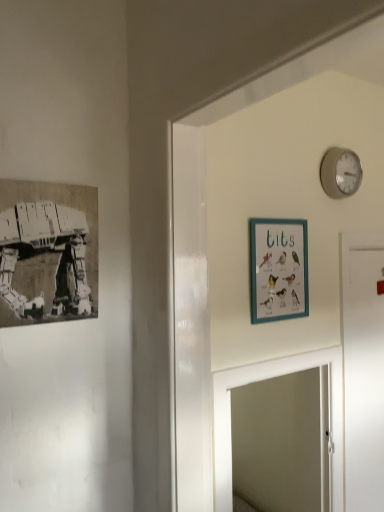
Question: Is black paper print at left, which is the 2th picture frame in back-to-front order, surrounded by teal wooden picture frame at upper center, acting as the 1th picture frame starting from the back?

Choices:
 (A) yes
 (B) no

Answer: (B)

Question: Can we say teal wooden picture frame at upper center, positioned as the 2th picture frame in left-to-right order, lies outside black paper print at left, acting as the 1th picture frame starting from the left?

Choices:
 (A) no
 (B) yes

Answer: (B)

Question: Can you confirm if teal wooden picture frame at upper center, marked as the first picture frame in a right-to-left arrangement, is thinner than black paper print at left, the second picture frame positioned from the right?

Choices:
 (A) no
 (B) yes

Answer: (B)

Question: From a real-world perspective, is teal wooden picture frame at upper center, positioned as the 2th picture frame in left-to-right order, over black paper print at left, which is counted as the 1th picture frame, starting from the front?

Choices:
 (A) yes
 (B) no

Answer: (B)

Question: Is teal wooden picture frame at upper center, which is counted as the second picture frame, starting from the front, aimed at black paper print at left, which is counted as the 1th picture frame, starting from the front?

Choices:
 (A) yes
 (B) no

Answer: (B)

Question: Is the depth of teal wooden picture frame at upper center, positioned as the 2th picture frame in left-to-right order, greater than that of black paper print at left, which is the 2th picture frame in back-to-front order?

Choices:
 (A) no
 (B) yes

Answer: (B)

Question: From the image's perspective, does black paper print at left, which is the 2th picture frame in back-to-front order, appear lower than teal wooden picture frame at upper center, positioned as the 2th picture frame in left-to-right order?

Choices:
 (A) yes
 (B) no

Answer: (B)

Question: Can you confirm if black paper print at left, which is the 2th picture frame in back-to-front order, is shorter than teal wooden picture frame at upper center, acting as the 1th picture frame starting from the back?

Choices:
 (A) yes
 (B) no

Answer: (A)

Question: Considering the relative positions of black paper print at left, which is counted as the 1th picture frame, starting from the front, and teal wooden picture frame at upper center, which is counted as the second picture frame, starting from the front, in the image provided, is black paper print at left, which is counted as the 1th picture frame, starting from the front, to the left of teal wooden picture frame at upper center, which is counted as the second picture frame, starting from the front, from the viewer's perspective?

Choices:
 (A) no
 (B) yes

Answer: (B)

Question: Is black paper print at left, the second picture frame positioned from the right, next to teal wooden picture frame at upper center, which is counted as the second picture frame, starting from the front, and touching it?

Choices:
 (A) no
 (B) yes

Answer: (A)

Question: Is black paper print at left, which is the 2th picture frame in back-to-front order, behind teal wooden picture frame at upper center, acting as the 1th picture frame starting from the back?

Choices:
 (A) yes
 (B) no

Answer: (B)

Question: Is black paper print at left, acting as the 1th picture frame starting from the left, smaller than teal wooden picture frame at upper center, acting as the 1th picture frame starting from the back?

Choices:
 (A) no
 (B) yes

Answer: (A)

Question: Is black paper print at left, which is the 2th picture frame in back-to-front order, next to white matte door at right and touching it?

Choices:
 (A) no
 (B) yes

Answer: (A)